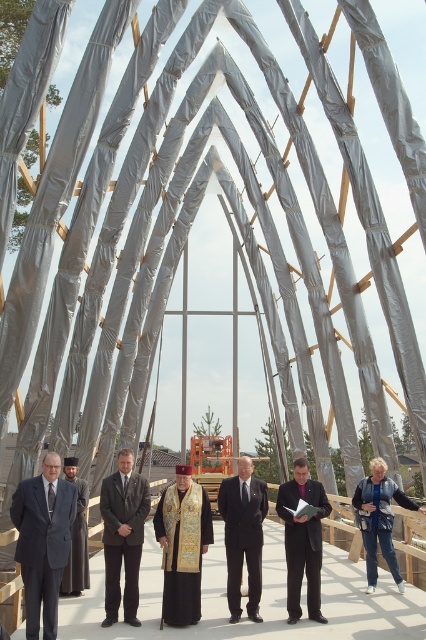
Question: Which point is closer to the camera?

Choices:
 (A) black suit at center
 (B) gray wool coat at left
 (C) dark gray suit at center

Answer: (C)

Question: Among these points, which one is farthest from the camera?

Choices:
 (A) (301, 614)
 (B) (127, 586)

Answer: (B)

Question: From the image, what is the correct spatial relationship of black suit at center in relation to dark suit at center?

Choices:
 (A) right
 (B) left

Answer: (B)

Question: Does gold embroidered vestment at center appear under gray wool coat at left?

Choices:
 (A) no
 (B) yes

Answer: (A)

Question: Which object appears closest to the camera in this image?

Choices:
 (A) dark suit at center
 (B) gold embroidered vestment at center
 (C) gray wool coat at left
 (D) dark gray suit at center

Answer: (D)

Question: Does gold embroidered vestment at center have a larger size compared to dark gray suit at center?

Choices:
 (A) no
 (B) yes

Answer: (A)